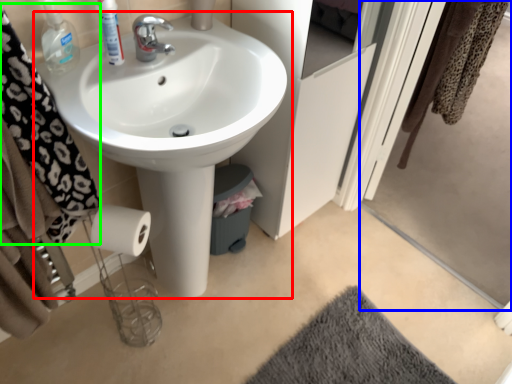
Question: Estimate the real-world distances between objects in this image. Which object is farther from sink (highlighted by a red box), screen door (highlighted by a blue box) or bath towel (highlighted by a green box)?

Choices:
 (A) screen door
 (B) bath towel

Answer: (A)